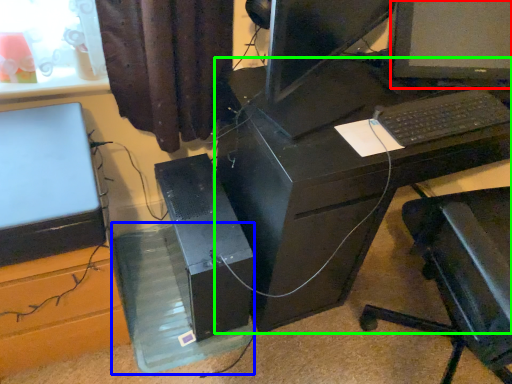
Question: Which object is the farthest from computer monitor (highlighted by a red box)? Choose among these: glass box (highlighted by a blue box) or desk (highlighted by a green box).

Choices:
 (A) glass box
 (B) desk

Answer: (A)